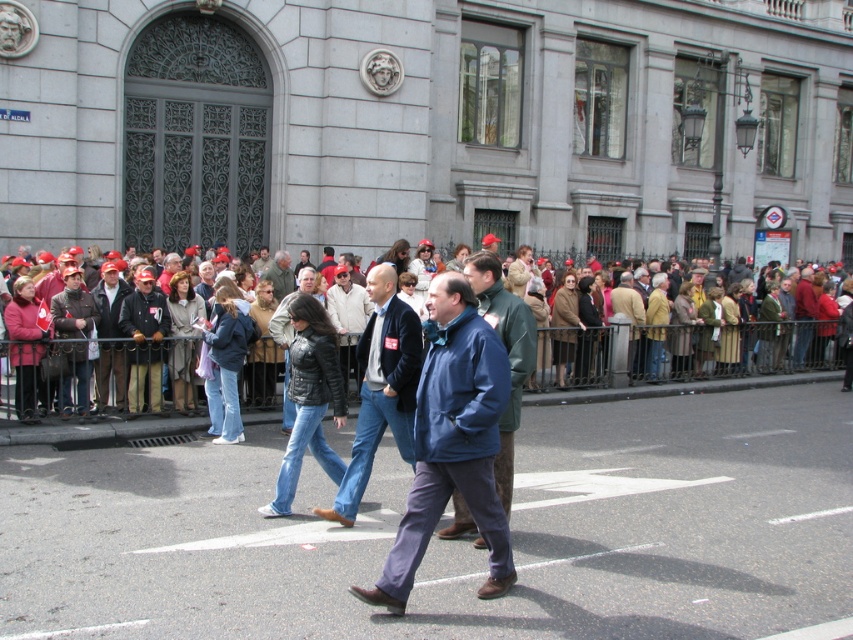
Question: Which of these objects is positioned closest to the blue fleece jacket at center?

Choices:
 (A) green fabric jacket at center
 (B) red fabric crowd at center

Answer: (B)

Question: Can you confirm if red fabric crowd at center is thinner than green fabric jacket at center?

Choices:
 (A) no
 (B) yes

Answer: (A)

Question: Which object is the farthest from the blue fleece jacket at center?

Choices:
 (A) leather jacket at center
 (B) red fabric crowd at center
 (C) blue fabric jacket at center
 (D) green fabric jacket at center

Answer: (D)

Question: Does blue fleece jacket at center have a larger size compared to blue fabric jacket at center?

Choices:
 (A) no
 (B) yes

Answer: (B)

Question: Does leather jacket at center have a larger size compared to green fabric jacket at center?

Choices:
 (A) no
 (B) yes

Answer: (A)

Question: Which is farther from the leather jacket at center?

Choices:
 (A) blue fleece jacket at center
 (B) green fabric jacket at center
 (C) red fabric crowd at center

Answer: (B)